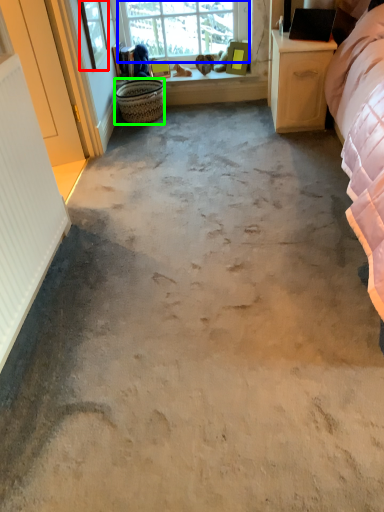
Question: Which is nearer to the window screen (highlighted by a red box)? window (highlighted by a blue box) or basket (highlighted by a green box).

Choices:
 (A) window
 (B) basket

Answer: (B)